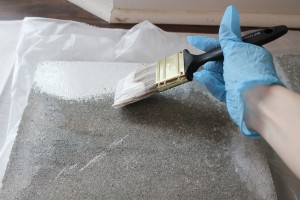
Where is `paint`? This screenshot has height=200, width=300. paint is located at coordinates (76, 82), (128, 89).